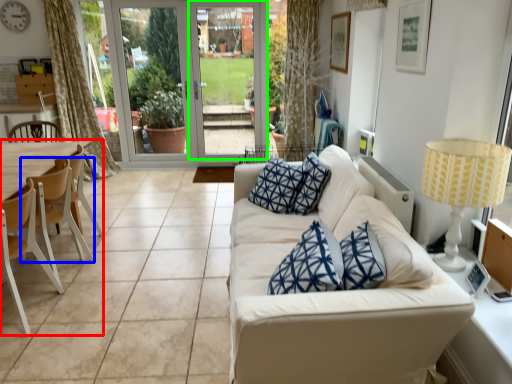
Question: Which is nearer to the armchair (highlighted by a red box)? chair (highlighted by a blue box) or screen door (highlighted by a green box).

Choices:
 (A) chair
 (B) screen door

Answer: (A)